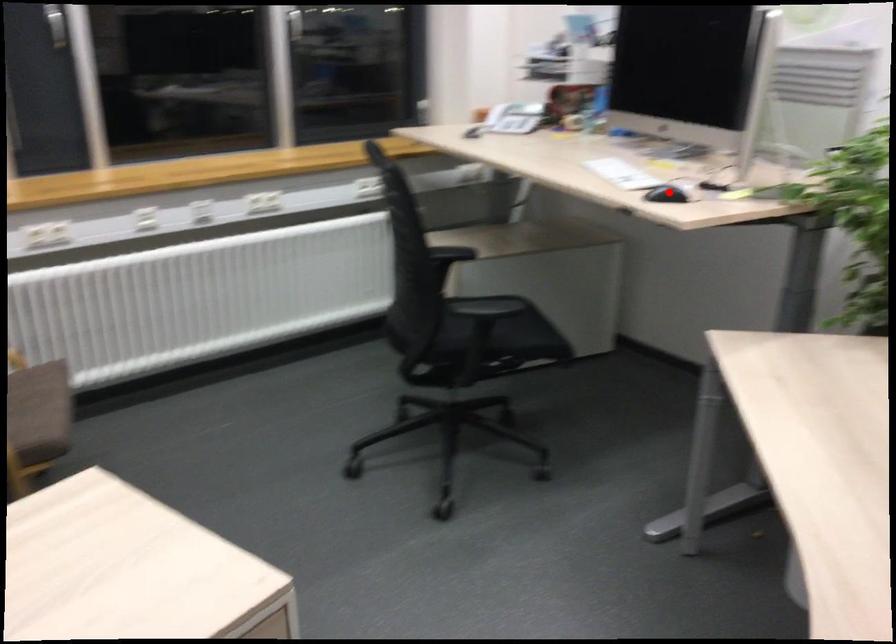
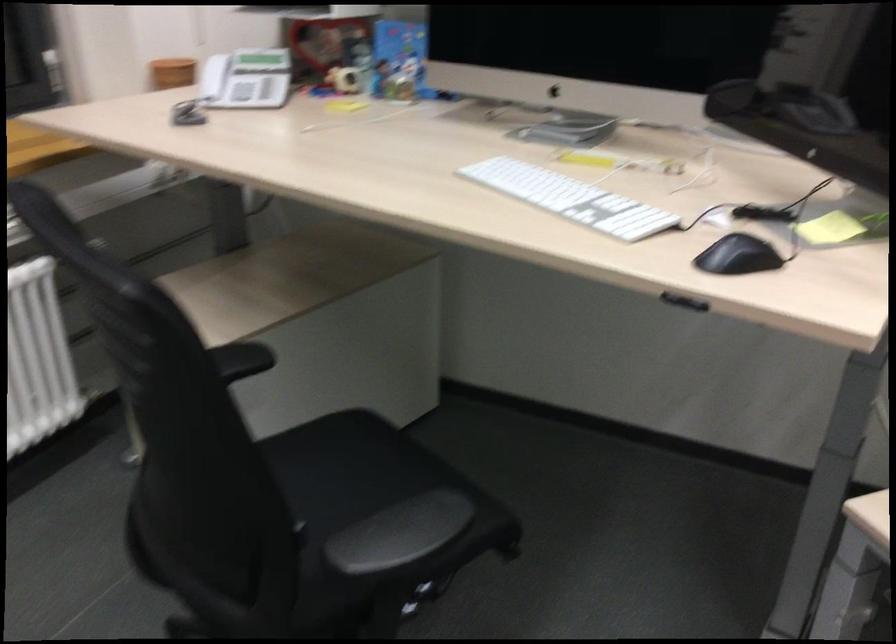
Question: I am providing you with two images of the same scene from different viewpoints. A red point is marked on the first image. Is the red point's position out of view in image 2?

Choices:
 (A) Yes
 (B) No

Answer: (B)